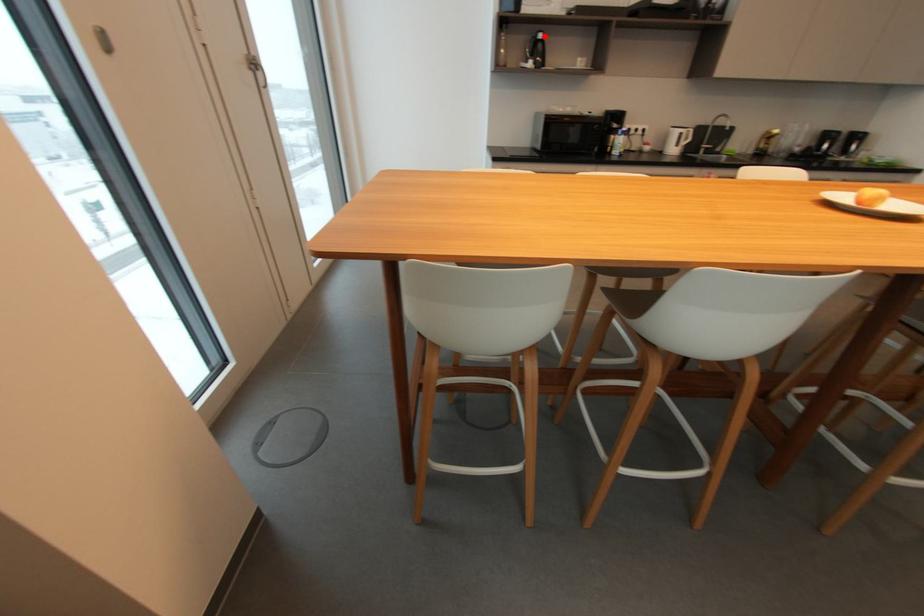
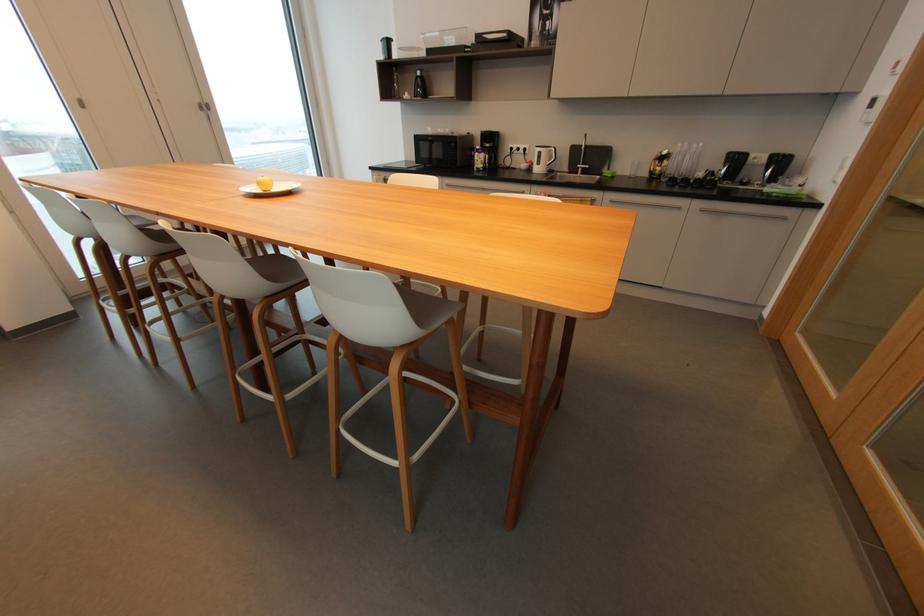
Question: A red point is marked in image1. In image2, is the corresponding 3D point closer to the camera or farther? Reply with the corresponding letter.

Choices:
 (A) The corresponding 3D point is closer.
 (B) The corresponding 3D point is farther.

Answer: (A)